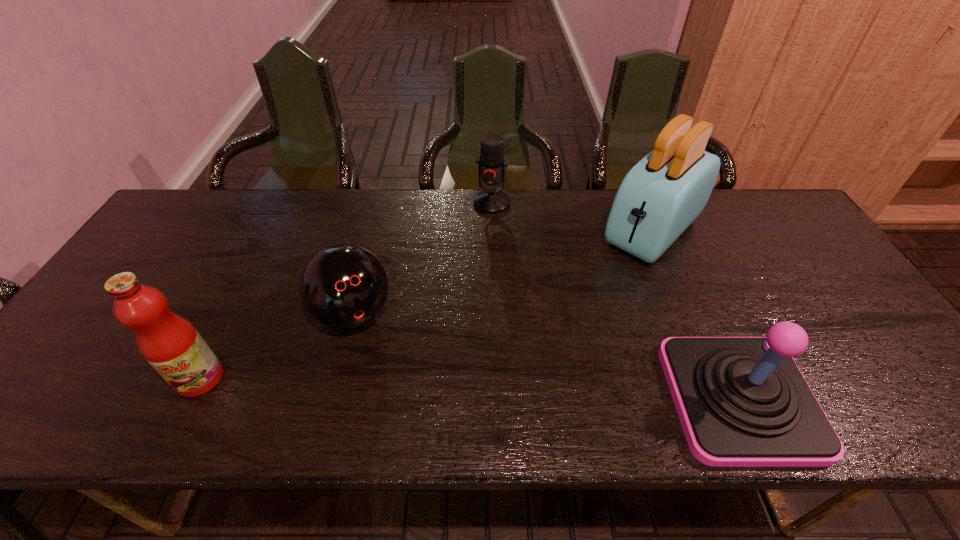
Where is `the leftmost object`? This screenshot has height=540, width=960. the leftmost object is located at coordinates (170, 344).

You are a GUI agent. You are given a task and a screenshot of the screen. Output one action in this format:
    pyautogui.click(x=<x>, y=<y>)
    Task: Click on the joystick
    Image resolution: width=960 pixels, height=540 pixels.
    Given the screenshot: What is the action you would take?
    pyautogui.click(x=742, y=401)

Identify the location of the third object from left to right. (492, 164).

Locate an element on the screen. bowling ball is located at coordinates 343,286.

This screenshot has height=540, width=960. Identify the location of toaster. (658, 199).

You are a GUI agent. You are given a task and a screenshot of the screen. Output one action in this format:
    pyautogui.click(x=<x>, y=<y>)
    Task: Click on the vacant space situated 0.270m on the side of the microphone with the red ring
    The height and width of the screenshot is (540, 960).
    Given the screenshot: What is the action you would take?
    pyautogui.click(x=466, y=272)

Locate an element on the screen. This screenshot has width=960, height=540. free spot located 0.190m on the side of the microphone with the red ring is located at coordinates (472, 253).

Where is `vacant area situated on the side of the microphone with the red ring`? Image resolution: width=960 pixels, height=540 pixels. vacant area situated on the side of the microphone with the red ring is located at coordinates (456, 299).

This screenshot has height=540, width=960. Identify the location of free region located on the surface of the bowling ball near the finger holes. 391,390.

I want to click on free region located on the surface of the bowling ball near the finger holes, so click(x=387, y=383).